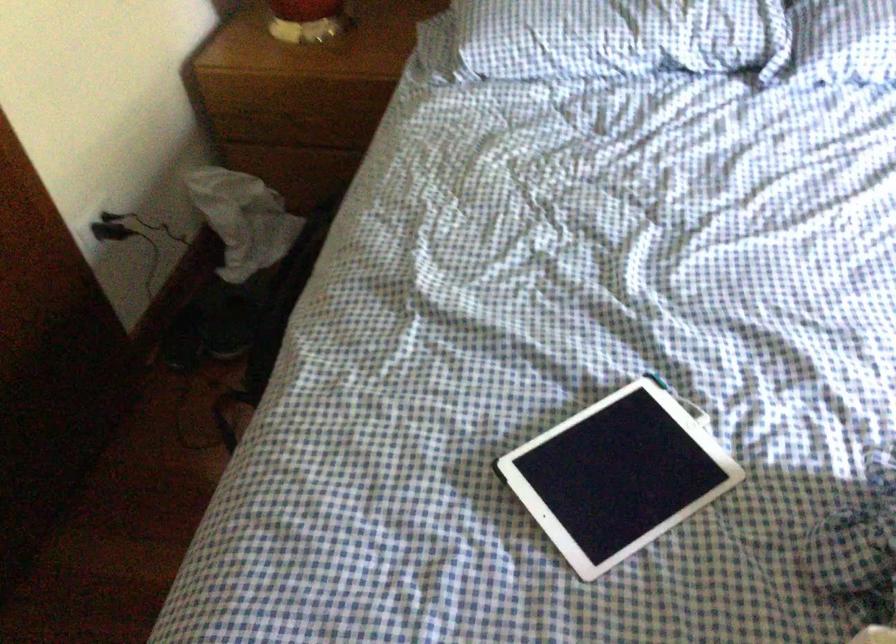
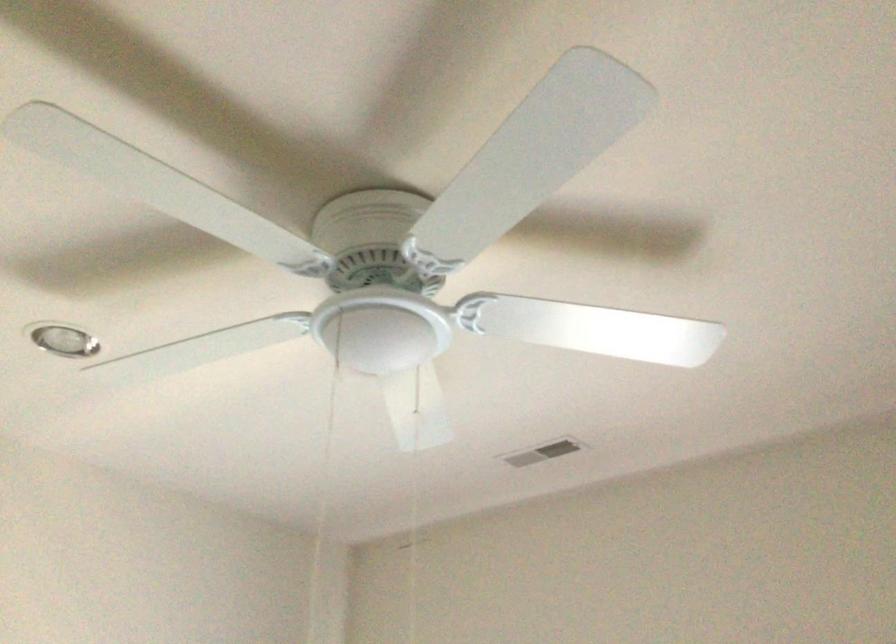
First-person continuous shooting, in which direction is the camera rotating?

The rotation direction of the camera is right-up.